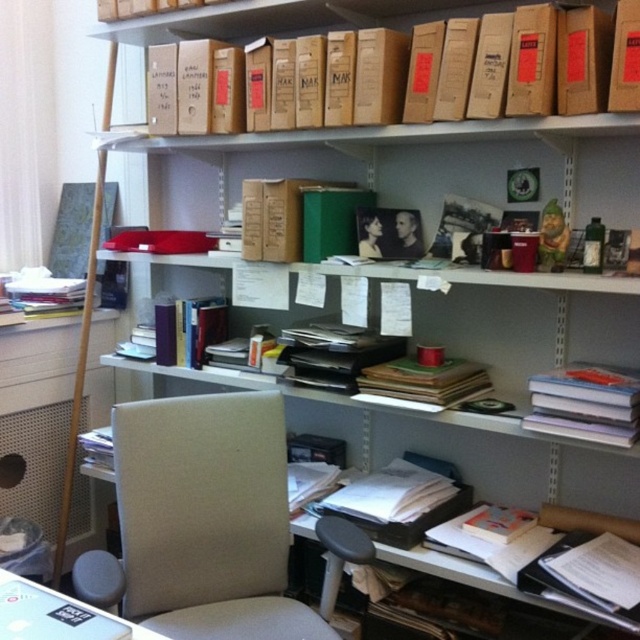
Is beige fabric swivel chair at center wider than hardcover book at center?

Correct, the width of beige fabric swivel chair at center exceeds that of hardcover book at center.

Who is higher up, beige fabric swivel chair at center or hardcover book at center?

Positioned higher is hardcover book at center.

Is point (237, 424) in front of point (444, 387)?

Yes, point (237, 424) is closer to viewer.

Locate an element on the screen. beige fabric swivel chair at center is located at coordinates (209, 524).

Is point (609, 413) farther from viewer compared to point (376, 385)?

No.

This screenshot has height=640, width=640. I want to click on white paper stack at center-right, so click(x=586, y=403).

Between beige fabric swivel chair at center and white paper stack at center-right, which one appears on the left side from the viewer's perspective?

Positioned to the left is beige fabric swivel chair at center.

Describe the element at coordinates (209, 524) in the screenshot. I see `beige fabric swivel chair at center` at that location.

This screenshot has height=640, width=640. Identify the location of beige fabric swivel chair at center. (209, 524).